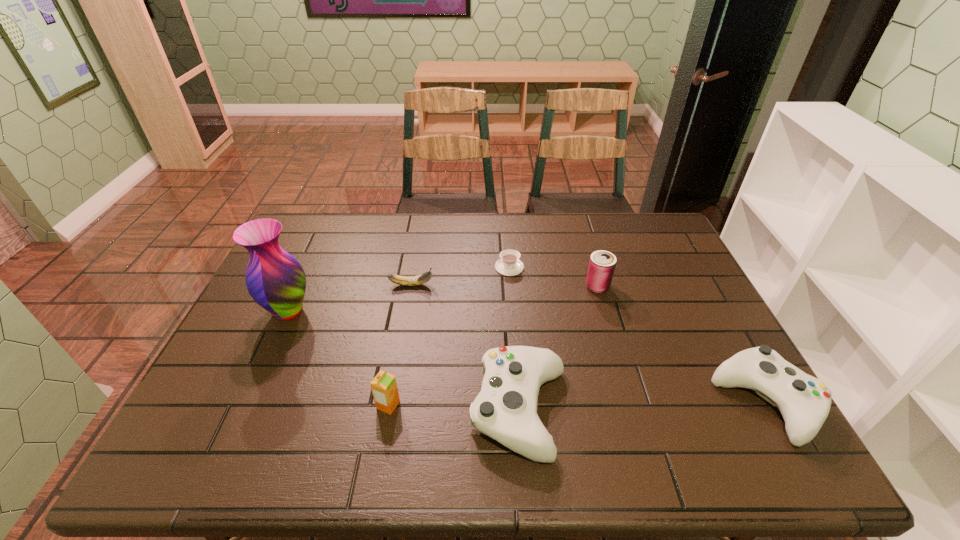
Considering the uniform spacing of controls, where should an additional control be positioned on the left? Please locate a free spot. Please provide its 2D coordinates. Your answer should be formatted as a tuple, i.e. [(x, y)], where the tuple contains the x and y coordinates of a point satisfying the conditions above.

[(263, 420)]